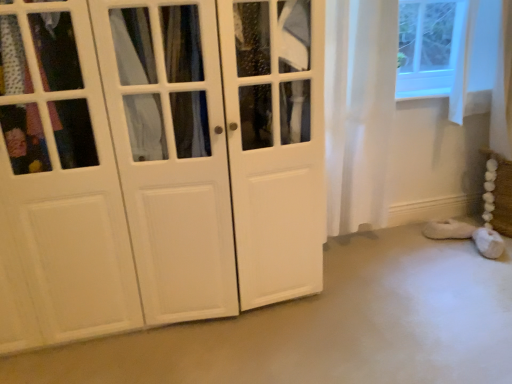
The image size is (512, 384). Describe the element at coordinates (359, 110) in the screenshot. I see `white sheer curtain at right` at that location.

Measure the distance between point (51, 296) and camera.

Point (51, 296) and camera are 5.17 feet apart.

This screenshot has height=384, width=512. In order to click on white fluffy slipper at lower right in this screenshot , I will do `click(448, 229)`.

This screenshot has width=512, height=384. Describe the element at coordinates (448, 229) in the screenshot. I see `white fluffy slipper at lower right` at that location.

You are a GUI agent. You are given a task and a screenshot of the screen. Output one action in this format:
    pyautogui.click(x=<x>, y=<y>)
    Task: Click on the white sheer curtain at right
    
    Given the screenshot: What is the action you would take?
    pyautogui.click(x=359, y=110)

Can white sheer curtain at right be found inside white matte cabinet at left?

Actually, white sheer curtain at right is outside white matte cabinet at left.

From a real-world perspective, is white matte cabinet at left positioned over white sheer curtain at right based on gravity?

No, from a real-world perspective, white matte cabinet at left is not above white sheer curtain at right.

Which object is closer to the camera, white matte cabinet at left or white sheer curtain at right?

white matte cabinet at left is more forward.

From the picture: Considering the positions of objects white matte cabinet at left and white fluffy slipper at lower right in the image provided, who is more to the right, white matte cabinet at left or white fluffy slipper at lower right?

white fluffy slipper at lower right.

How different are the orientations of white matte cabinet at left and white fluffy slipper at lower right in degrees?

The angular difference between white matte cabinet at left and white fluffy slipper at lower right is 23.9 degrees.

Is white matte cabinet at left placed right next to white fluffy slipper at lower right?

No, white matte cabinet at left is not in contact with white fluffy slipper at lower right.

This screenshot has width=512, height=384. In order to click on cupboard above the white fluffy slipper at lower right (from the image's perspective) in this screenshot , I will do `click(156, 162)`.

Which is more to the left, white fluffy slipper at lower right or white sheer curtain at right?

white sheer curtain at right.

From the image's perspective, is white fluffy slipper at lower right located above or below white sheer curtain at right?

white fluffy slipper at lower right is situated lower than white sheer curtain at right in the image.

Could white sheer curtain at right be considered to be inside white fluffy slipper at lower right?

No.

Which is in front, point (453, 237) or point (332, 129)?

The point (332, 129) is in front.

From the image's perspective, between white sheer curtain at right and white matte cabinet at left, which one is located above?

white sheer curtain at right.

Are white sheer curtain at right and white matte cabinet at left beside each other?

white sheer curtain at right and white matte cabinet at left are clearly separated.

Which object is further away from the camera taking this photo, white sheer curtain at right or white matte cabinet at left?

white sheer curtain at right is further from the camera.

Can you confirm if white sheer curtain at right is shorter than white matte cabinet at left?

Correct, white sheer curtain at right is not as tall as white matte cabinet at left.

Is white fluffy slipper at lower right outside of white matte cabinet at left?

Yes, white fluffy slipper at lower right is not within white matte cabinet at left.

Is white fluffy slipper at lower right facing away from white matte cabinet at left?

No, white fluffy slipper at lower right is not facing away from white matte cabinet at left.

Considering the sizes of objects white fluffy slipper at lower right and white matte cabinet at left in the image provided, who is wider, white fluffy slipper at lower right or white matte cabinet at left?

white matte cabinet at left is wider.

Between white sheer curtain at right and white fluffy slipper at lower right, which one has larger size?

white sheer curtain at right is bigger.

Is white sheer curtain at right not near white fluffy slipper at lower right?

white sheer curtain at right is near white fluffy slipper at lower right, not far away.

Locate an element on the screen. Image resolution: width=512 pixels, height=384 pixels. curtain in front of the white fluffy slipper at lower right is located at coordinates (359, 110).

Considering the positions of points (383, 143) and (457, 232), is point (383, 143) farther from camera compared to point (457, 232)?

That is False.

At what (x,y) coordinates should I click in order to perform the action: click on curtain on the right of white matte cabinet at left. Please return your answer as a coordinate pair (x, y). This screenshot has width=512, height=384. Looking at the image, I should click on (359, 110).

Find the location of a particular element. The width and height of the screenshot is (512, 384). footwear that appears below the white matte cabinet at left (from the image's perspective) is located at coordinates point(448,229).

Considering their positions, is white fluffy slipper at lower right positioned closer to white sheer curtain at right than white matte cabinet at left?

white matte cabinet at left is positioned closer to the anchor white sheer curtain at right.

Estimate the real-world distances between objects in this image. Which object is closer to white sheer curtain at right, white matte cabinet at left or white fluffy slipper at lower right?

white matte cabinet at left lies closer to white sheer curtain at right than the other object.

From the image, which object appears to be nearer to white fluffy slipper at lower right, white matte cabinet at left or white sheer curtain at right?

white sheer curtain at right lies closer to white fluffy slipper at lower right than the other object.

From the image, which object appears to be farther from white matte cabinet at left, white sheer curtain at right or white fluffy slipper at lower right?

white fluffy slipper at lower right is positioned further to the anchor white matte cabinet at left.

Which object lies further to the anchor point white fluffy slipper at lower right, white sheer curtain at right or white matte cabinet at left?

Based on the image, white matte cabinet at left appears to be further to white fluffy slipper at lower right.

From the picture: When comparing their distances from white matte cabinet at left, does white fluffy slipper at lower right or white sheer curtain at right seem closer?

The object closer to white matte cabinet at left is white sheer curtain at right.

Identify the location of curtain situated between white matte cabinet at left and white fluffy slipper at lower right from left to right. This screenshot has height=384, width=512. (359, 110).